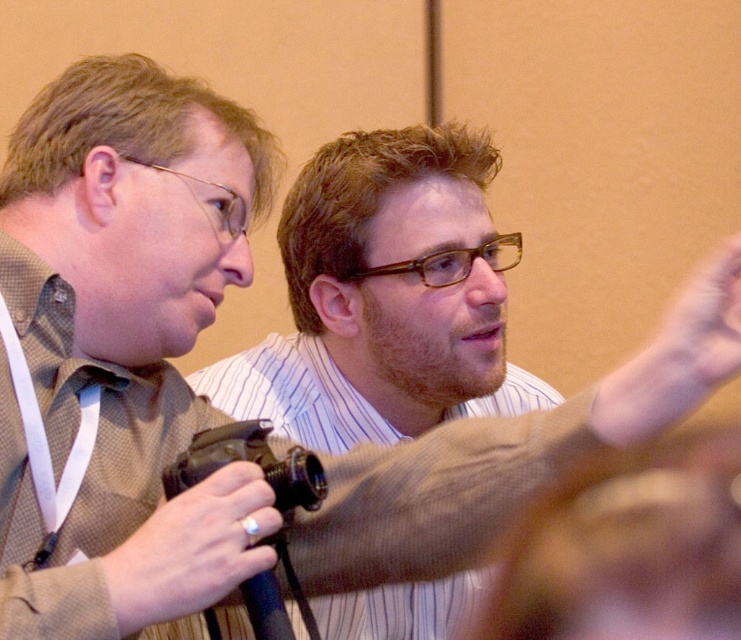
Question: Is matte brown camera at left bigger than brown leather belt at center?

Choices:
 (A) yes
 (B) no

Answer: (A)

Question: Does matte brown camera at left have a lesser width compared to brown leather belt at center?

Choices:
 (A) no
 (B) yes

Answer: (A)

Question: Is silver metallic ring at lower left closer to camera compared to smooth skin hand at upper right?

Choices:
 (A) no
 (B) yes

Answer: (A)

Question: Which object is the farthest from the brown leather belt at center?

Choices:
 (A) matte brown camera at left
 (B) silver metallic ring at lower left

Answer: (A)

Question: Estimate the real-world distances between objects in this image. Which object is closer to the brown leather belt at center?

Choices:
 (A) silver metallic ring at lower left
 (B) smooth skin hand at upper right

Answer: (B)

Question: Which point is closer to the camera taking this photo?

Choices:
 (A) (225, 515)
 (B) (717, 371)
 (C) (518, 580)

Answer: (C)